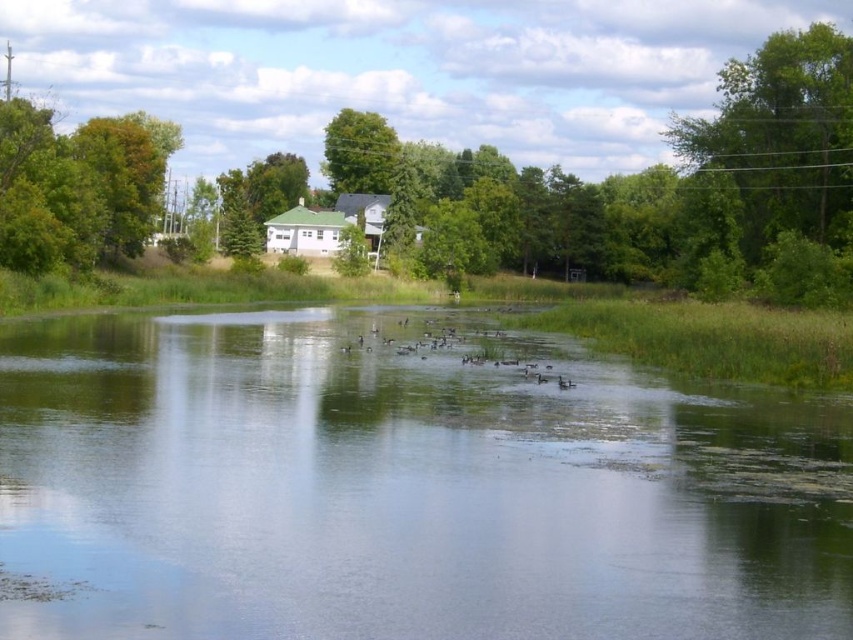
Who is shorter, green grassy water at center or green leafy tree at upper left?

With less height is green grassy water at center.

From the picture: Is green grassy water at center thinner than green leafy tree at upper left?

No, green grassy water at center is not thinner than green leafy tree at upper left.

Between point (619, 564) and point (108, 221), which one is positioned behind?

The point (108, 221) is behind.

Where is `green grassy water at center`? The height and width of the screenshot is (640, 853). green grassy water at center is located at coordinates (404, 486).

In the scene shown: Which is more to the left, green grassy water at center or brown matte duck at center?

From the viewer's perspective, brown matte duck at center appears more on the left side.

Does point (558, 604) lie in front of point (396, 340)?

That is True.

The width and height of the screenshot is (853, 640). Identify the location of green grassy water at center. (404, 486).

Does green leafy tree at upper left have a lesser height compared to green leafy tree at center?

Yes.

Is green leafy tree at upper left below green leafy tree at center?

Yes, green leafy tree at upper left is below green leafy tree at center.

This screenshot has width=853, height=640. What do you see at coordinates (77, 186) in the screenshot?
I see `green leafy tree at upper left` at bounding box center [77, 186].

The image size is (853, 640). I want to click on green leafy tree at upper left, so click(x=77, y=186).